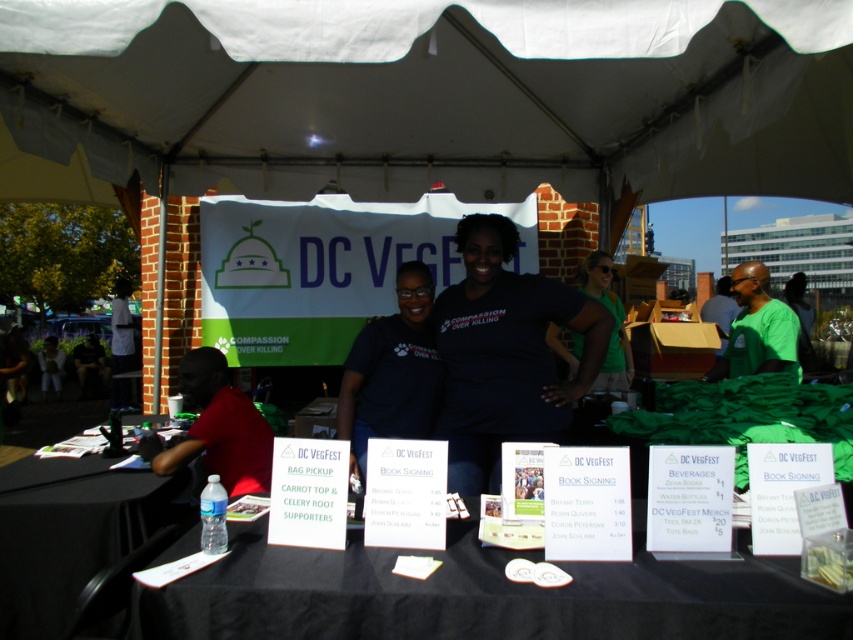
Is white fabric canopy at upper center taller than dark blue shirt at center?

Incorrect, white fabric canopy at upper center's height is not larger of dark blue shirt at center's.

Describe the element at coordinates (456, 90) in the screenshot. The width and height of the screenshot is (853, 640). I see `white fabric canopy at upper center` at that location.

Locate an element on the screen. This screenshot has height=640, width=853. white fabric canopy at upper center is located at coordinates (456, 90).

From the picture: Who is positioned more to the left, black fabric table at lower left or dark blue shirt at center?

From the viewer's perspective, black fabric table at lower left appears more on the left side.

The width and height of the screenshot is (853, 640). I want to click on black fabric table at lower left, so click(67, 532).

Locate an element on the screen. This screenshot has height=640, width=853. black fabric table at lower left is located at coordinates (67, 532).

Does black matte shirt at center have a lesser width compared to green matte shirt at right?

No, black matte shirt at center is not thinner than green matte shirt at right.

The height and width of the screenshot is (640, 853). What do you see at coordinates (505, 355) in the screenshot?
I see `black matte shirt at center` at bounding box center [505, 355].

At what (x,y) coordinates should I click in order to perform the action: click on black matte shirt at center. Please return your answer as a coordinate pair (x, y). Looking at the image, I should click on (505, 355).